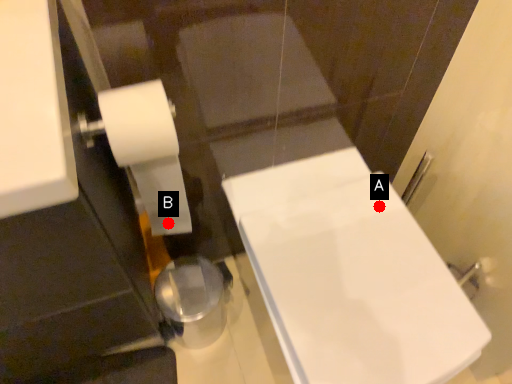
Question: Two points are circled on the image, labeled by A and B beside each circle. Which point appears closest to the camera in this image?

Choices:
 (A) A is closer
 (B) B is closer

Answer: (A)